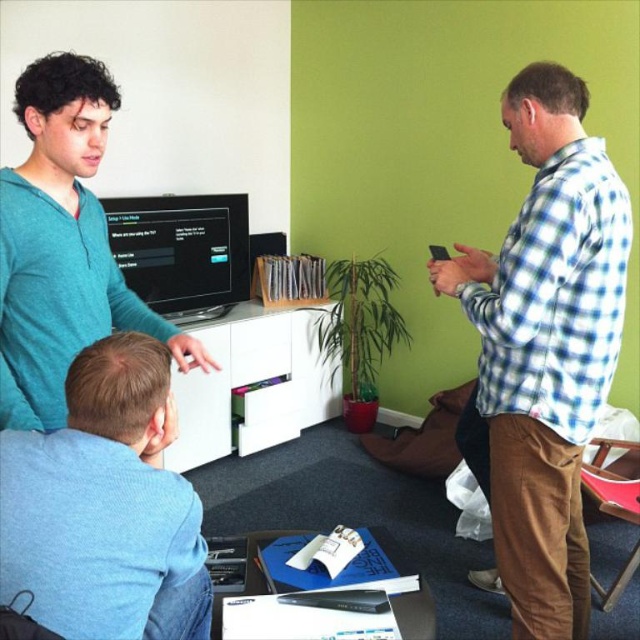
You are a guest in this room and want to see both the light blue cotton shirt at lower left and the black glossy monitor at center without moving your head. Is it possible?

The light blue cotton shirt at lower left is below the black glossy monitor at center, so if you position yourself so that your line of sight can view both vertically aligned objects simultaneously, you can see both without moving your head.

In the scene, you notice the blue checkered shirt at right and the black glossy monitor at center. Which object takes up more visual space in the image?

The blue checkered shirt at right has a larger size compared to the black glossy monitor at center, so it takes up more visual space in the image.

You are trying to see the screen of the black glossy monitor at center. Is the teal soft sweater at upper left blocking your view of the monitor?

The teal soft sweater at upper left is in front of the black glossy monitor at center, so it is blocking the view of the monitor.